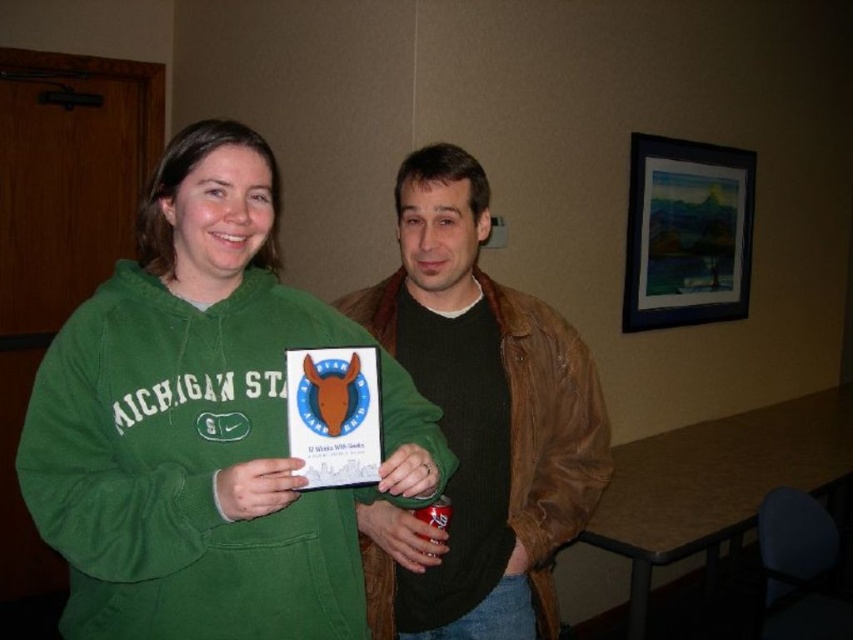
You are taking a photo of two people in a room. You want to focus on the person closer to the camera. Which point should you focus on, point (219, 464) or point (386, 547)?

Point (219, 464) is closer to the camera than point (386, 547), so you should focus on point (219, 464).

In the scene shown: You are a photographer trying to capture both the green fleece sweatshirt at center and the brown leather jacket at center in a single frame. Given their sizes, which one should you focus on to ensure both are clearly visible in the photo?

The green fleece sweatshirt at center is smaller than the brown leather jacket at center. To ensure both are clearly visible, focus on the larger brown leather jacket at center while positioning the smaller green fleece sweatshirt at center within the frame.

You are a photographer preparing to take a group photo of the two people in the image. You want to ensure that both the green fleece sweatshirt at center and the brown leather jacket at center are clearly visible in the final shot. Given their current positions, which clothing item should you focus on to ensure both are visible?

The green fleece sweatshirt at center is in front of the brown leather jacket at center, so focusing on the green fleece sweatshirt at center will ensure both are visible as it is closer to the camera.